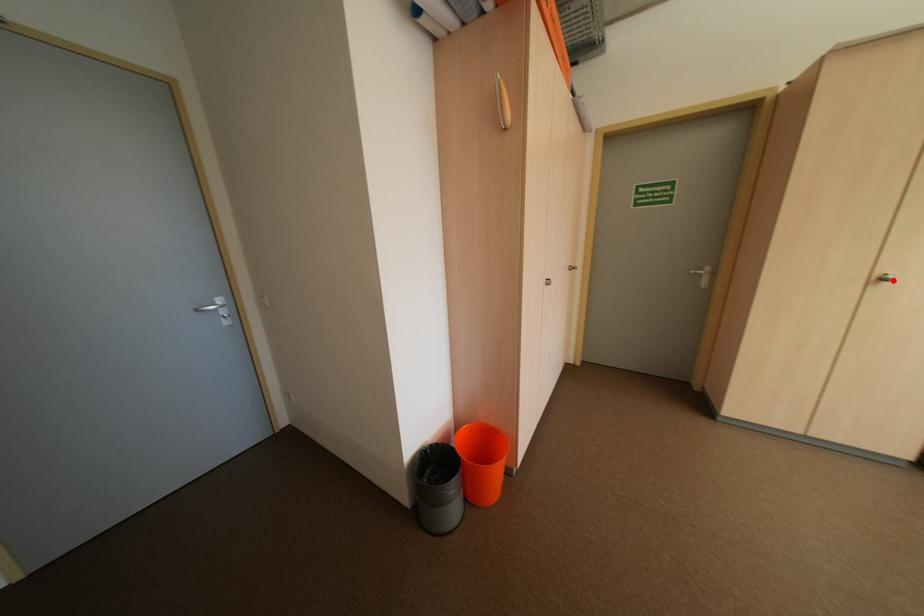
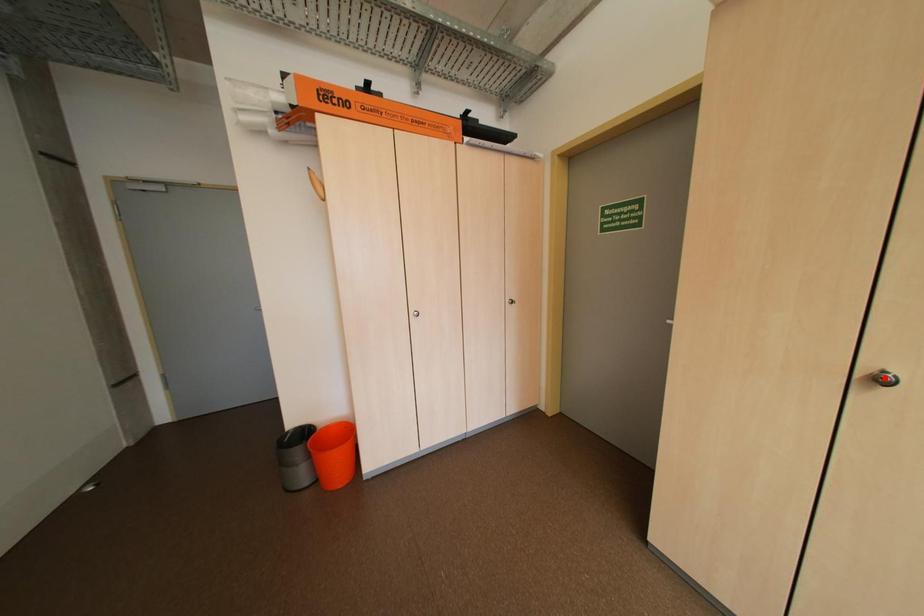
I am providing you with two images of the same scene from different viewpoints. A red point is marked on the first image and another point is marked on the second image. Do the highlighted points in image1 and image2 indicate the same real-world spot?

No